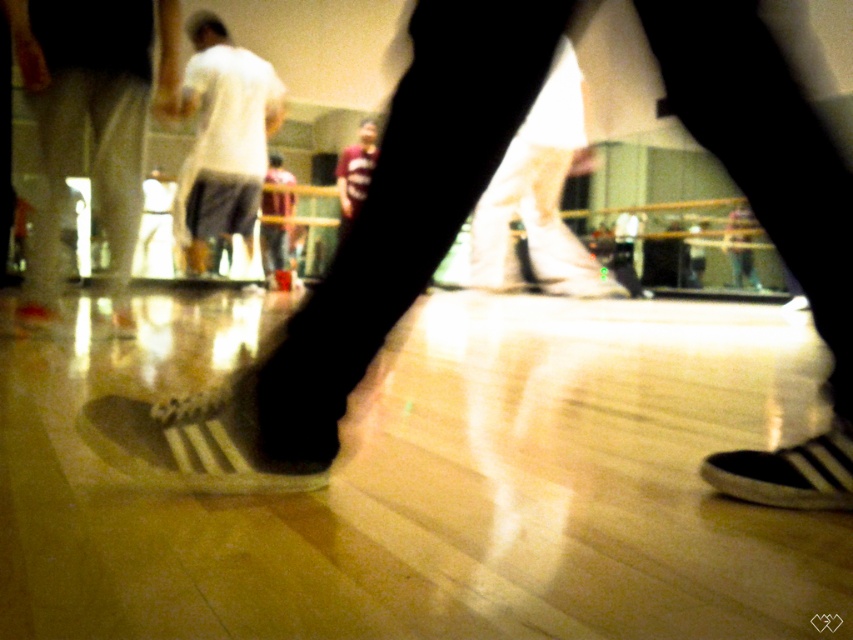
From the picture: You are a photographer trying to capture a clear shot of the white matte sneakers at center and the white matte sneaker at lower center. Which one is more likely to be in focus given the depth of field?

The white matte sneakers at center is positioned over white matte sneaker at lower center, so it is more likely to be in focus due to its central placement and depth of field prioritizing closer subjects.